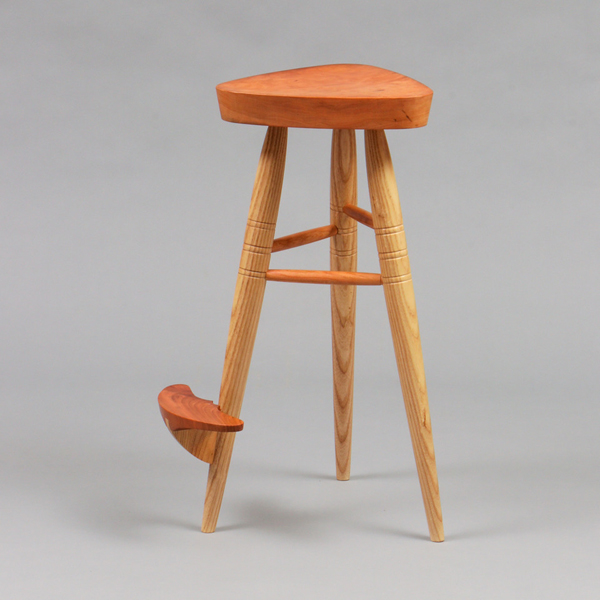
Find the location of a particular element. This screenshot has width=600, height=600. dark wood is located at coordinates (195, 442).